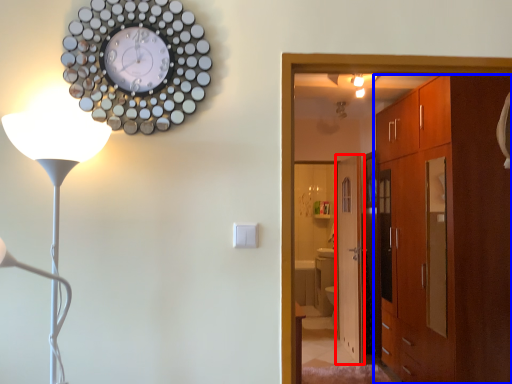
Question: Which object appears closest to the camera in this image, door (highlighted by a red box) or cabinetry (highlighted by a blue box)?

Choices:
 (A) door
 (B) cabinetry

Answer: (B)